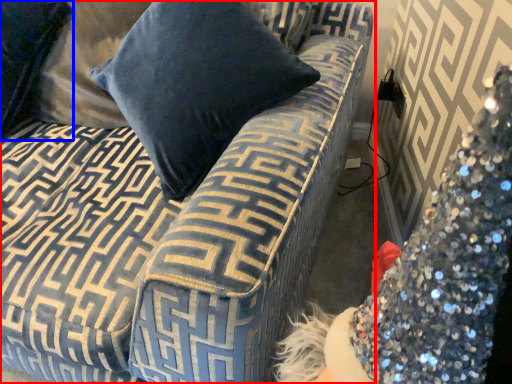
Question: Which object appears closest to the camera in this image, studio couch (highlighted by a red box) or pillow (highlighted by a blue box)?

Choices:
 (A) studio couch
 (B) pillow

Answer: (A)